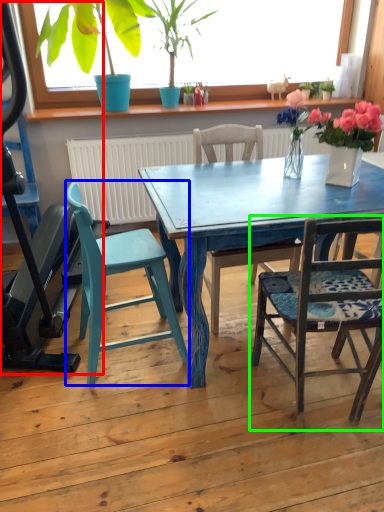
Question: Based on their relative distances, which object is farther from baby carriage (highlighted by a red box)? Choose from chair (highlighted by a blue box) and chair (highlighted by a green box).

Choices:
 (A) chair
 (B) chair

Answer: (B)